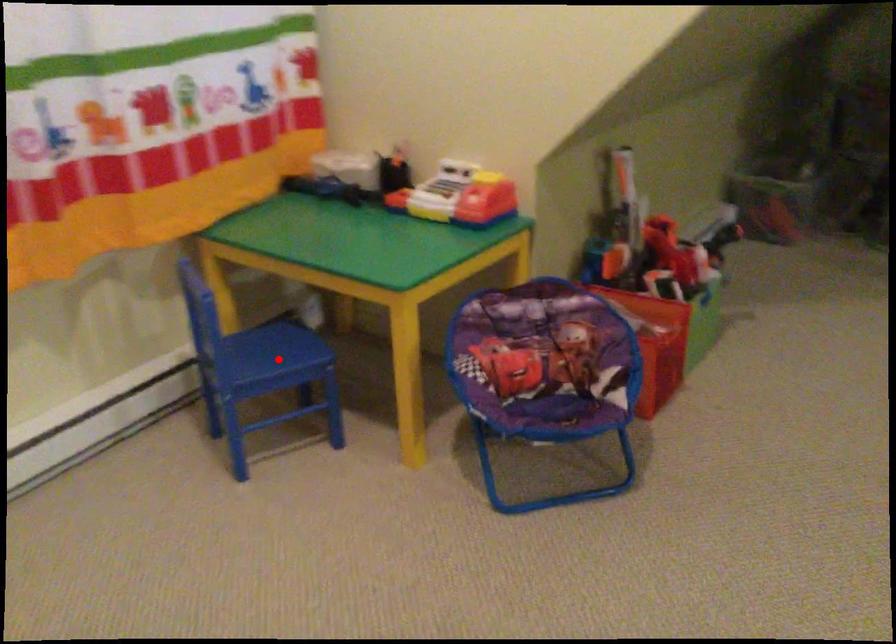
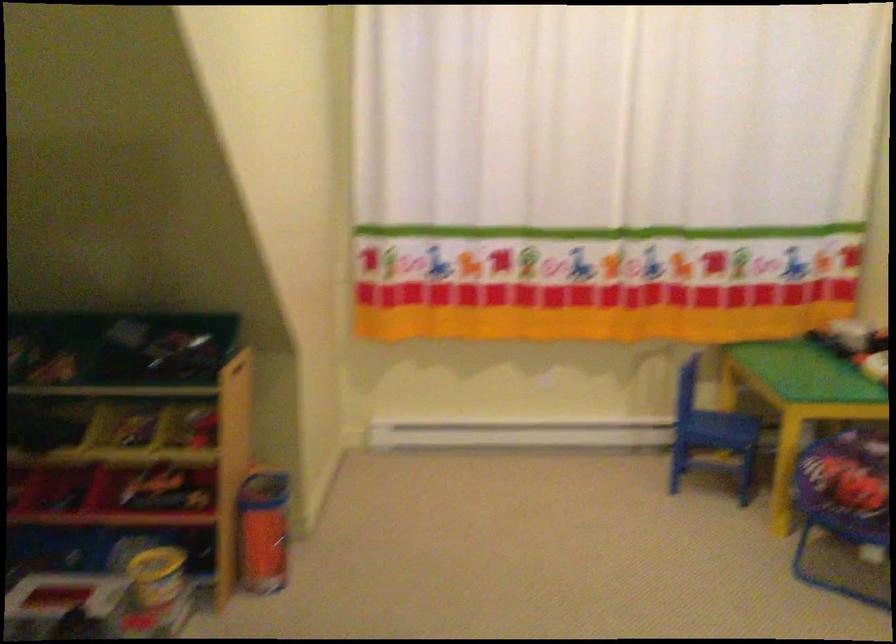
In the second image, find the point that corresponds to the highlighted location in the first image.

(718, 430)